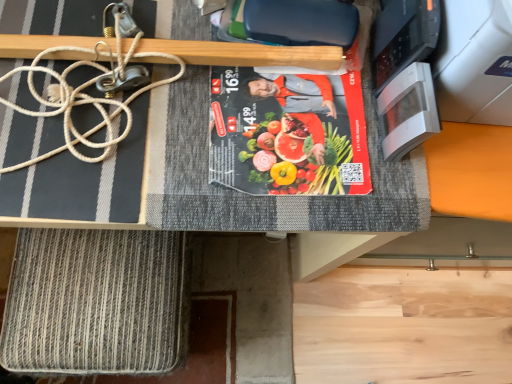
Image resolution: width=512 pixels, height=384 pixels. Identify the location of free point above white rope at upper left (from a real-world perspective). (77, 65).